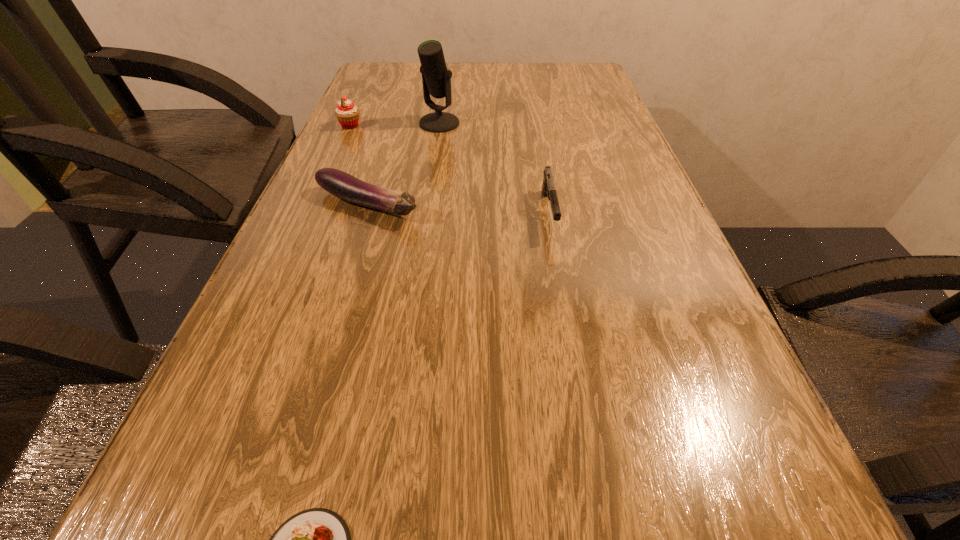
Find the location of a particular element. vacant area that lies between the fourth shortest object and the eggplant is located at coordinates (359, 166).

Locate an element on the screen. Image resolution: width=960 pixels, height=540 pixels. the closest object to the tallest object is located at coordinates (347, 113).

You are a GUI agent. You are given a task and a screenshot of the screen. Output one action in this format:
    pyautogui.click(x=<x>, y=<y>)
    Task: Click on the object that is the nearest to the eggplant
    The width and height of the screenshot is (960, 540).
    Given the screenshot: What is the action you would take?
    pyautogui.click(x=436, y=79)